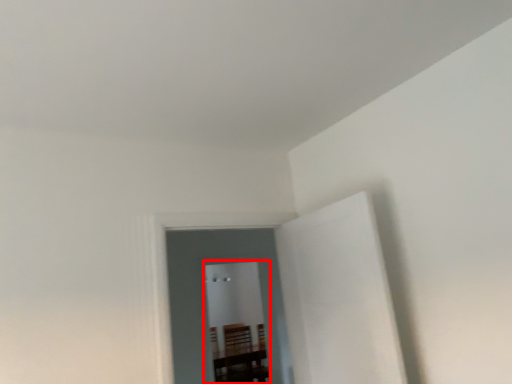
Question: From the image's perspective, where is glass door (annotated by the red box) located in relation to glass door in the image?

Choices:
 (A) above
 (B) below

Answer: (B)